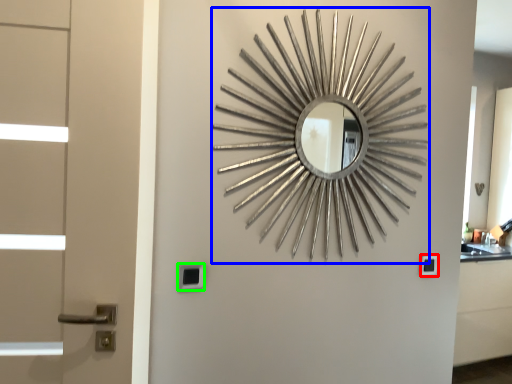
Question: Based on their relative distances, which object is farther from lock (highlighted by a red box)? Choose from design (highlighted by a blue box) and lock (highlighted by a green box).

Choices:
 (A) design
 (B) lock

Answer: (B)